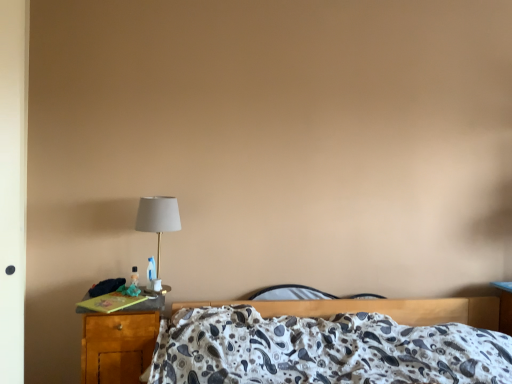
The width and height of the screenshot is (512, 384). Describe the element at coordinates (120, 342) in the screenshot. I see `wooden nightstand at lower left` at that location.

What do you see at coordinates (158, 218) in the screenshot? Image resolution: width=512 pixels, height=384 pixels. I see `matte gold table lamp at left` at bounding box center [158, 218].

What do you see at coordinates (333, 342) in the screenshot?
I see `patterned fabric bed at center` at bounding box center [333, 342].

The width and height of the screenshot is (512, 384). I want to click on wooden nightstand at lower left, so click(120, 342).

Is matte gold table lamp at left closer to the viewer compared to patterned fabric bed at center?

No, matte gold table lamp at left is behind patterned fabric bed at center.

From the image's perspective, between matte gold table lamp at left and patterned fabric bed at center, who is located below?

From the image's view, patterned fabric bed at center is below.

From a real-world perspective, is matte gold table lamp at left under patterned fabric bed at center?

No.

Is matte gold table lamp at left touching patterned fabric bed at center?

No, matte gold table lamp at left is not beside patterned fabric bed at center.

In terms of width, does patterned fabric bed at center look wider or thinner when compared to matte gold table lamp at left?

In the image, patterned fabric bed at center appears to be wider than matte gold table lamp at left.

Is patterned fabric bed at center located outside matte gold table lamp at left?

Yes.

The image size is (512, 384). Identify the location of bed directly beneath the matte gold table lamp at left (from a real-world perspective). (333, 342).

Locate an element on the screen. This screenshot has width=512, height=384. nightstand above the patterned fabric bed at center (from a real-world perspective) is located at coordinates (120, 342).

Is wooden nightstand at lower left with patterned fabric bed at center?

No, wooden nightstand at lower left is not with patterned fabric bed at center.

From the image's perspective, which object appears higher, wooden nightstand at lower left or patterned fabric bed at center?

From the image's view, wooden nightstand at lower left is above.

Is the depth of wooden nightstand at lower left less than that of patterned fabric bed at center?

No, it is behind patterned fabric bed at center.

Who is taller, patterned fabric bed at center or wooden nightstand at lower left?

With more height is patterned fabric bed at center.

Based on their sizes in the image, would you say patterned fabric bed at center is bigger or smaller than wooden nightstand at lower left?

Considering their sizes, patterned fabric bed at center takes up more space than wooden nightstand at lower left.

Considering the relative positions of patterned fabric bed at center and wooden nightstand at lower left in the image provided, is patterned fabric bed at center to the right of wooden nightstand at lower left from the viewer's perspective?

Correct, you'll find patterned fabric bed at center to the right of wooden nightstand at lower left.

From the image's perspective, is patterned fabric bed at center located above or below wooden nightstand at lower left?

Based on their image positions, patterned fabric bed at center is located beneath wooden nightstand at lower left.

From a real-world perspective, is matte gold table lamp at left over wooden nightstand at lower left?

Indeed, from a real-world perspective, matte gold table lamp at left stands above wooden nightstand at lower left.

Is matte gold table lamp at left to the left or to the right of wooden nightstand at lower left in the image?

In the image, matte gold table lamp at left appears on the right side of wooden nightstand at lower left.

Between wooden nightstand at lower left and matte gold table lamp at left, which one has smaller width?

With smaller width is matte gold table lamp at left.

Considering the relative positions of wooden nightstand at lower left and matte gold table lamp at left in the image provided, is wooden nightstand at lower left to the left or to the right of matte gold table lamp at left?

From the image, it's evident that wooden nightstand at lower left is to the left of matte gold table lamp at left.

Where is `nightstand below the matte gold table lamp at left (from a real-world perspective)`? nightstand below the matte gold table lamp at left (from a real-world perspective) is located at coordinates (120, 342).

The width and height of the screenshot is (512, 384). I want to click on bed on the right side of matte gold table lamp at left, so click(333, 342).

I want to click on bed in front of the matte gold table lamp at left, so pyautogui.click(x=333, y=342).

When comparing their distances from wooden nightstand at lower left, does patterned fabric bed at center or matte gold table lamp at left seem further?

The object further to wooden nightstand at lower left is patterned fabric bed at center.

Which object lies nearer to the anchor point matte gold table lamp at left, wooden nightstand at lower left or patterned fabric bed at center?

Based on the image, wooden nightstand at lower left appears to be nearer to matte gold table lamp at left.

Estimate the real-world distances between objects in this image. Which object is closer to wooden nightstand at lower left, matte gold table lamp at left or patterned fabric bed at center?

matte gold table lamp at left lies closer to wooden nightstand at lower left than the other object.

When comparing their distances from matte gold table lamp at left, does patterned fabric bed at center or wooden nightstand at lower left seem closer?

wooden nightstand at lower left is closer to matte gold table lamp at left.

Based on their spatial positions, is wooden nightstand at lower left or matte gold table lamp at left closer to patterned fabric bed at center?

wooden nightstand at lower left is positioned closer to the anchor patterned fabric bed at center.

Estimate the real-world distances between objects in this image. Which object is closer to patterned fabric bed at center, matte gold table lamp at left or wooden nightstand at lower left?

wooden nightstand at lower left is closer to patterned fabric bed at center.

The height and width of the screenshot is (384, 512). Find the location of `table lamp between wooden nightstand at lower left and patterned fabric bed at center in the horizontal direction`. table lamp between wooden nightstand at lower left and patterned fabric bed at center in the horizontal direction is located at coordinates (158, 218).